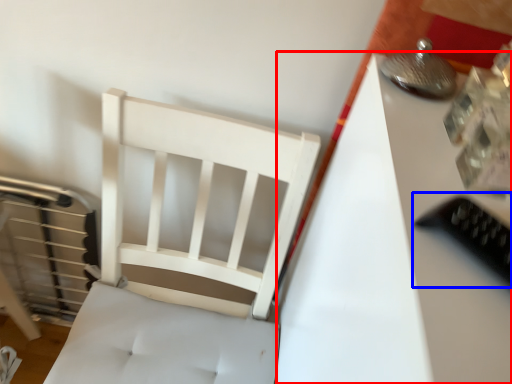
Question: Which of the following is the farthest to the observer, table (highlighted by a red box) or equipment (highlighted by a blue box)?

Choices:
 (A) table
 (B) equipment

Answer: (A)